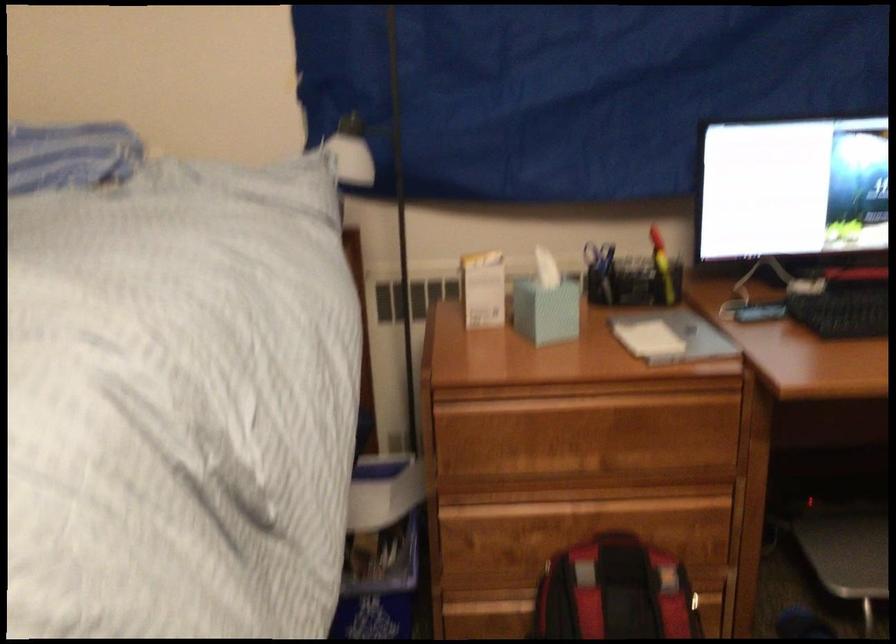
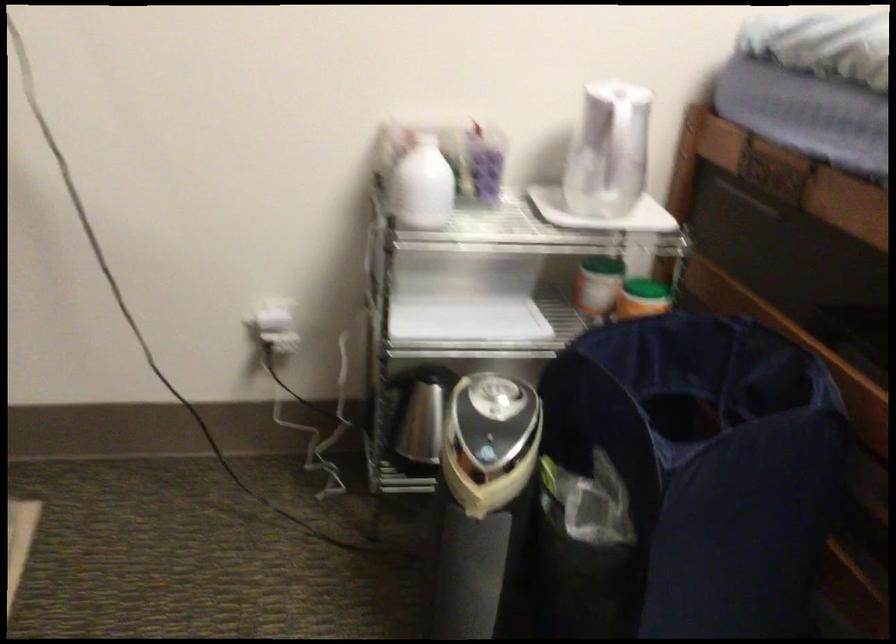
The first image is from the beginning of the video and the second image is from the end. How did the camera likely rotate when shooting the video?

The camera rotated toward left-down.